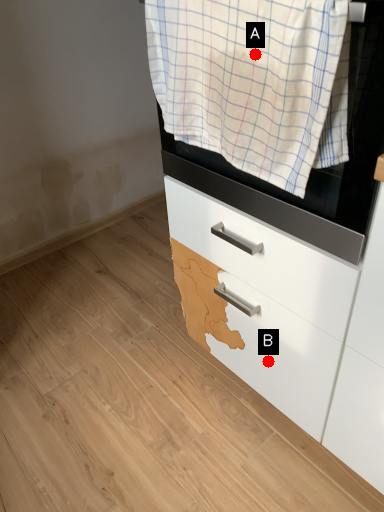
Question: Two points are circled on the image, labeled by A and B beside each circle. Which point appears farthest from the camera in this image?

Choices:
 (A) A is further
 (B) B is further

Answer: (B)